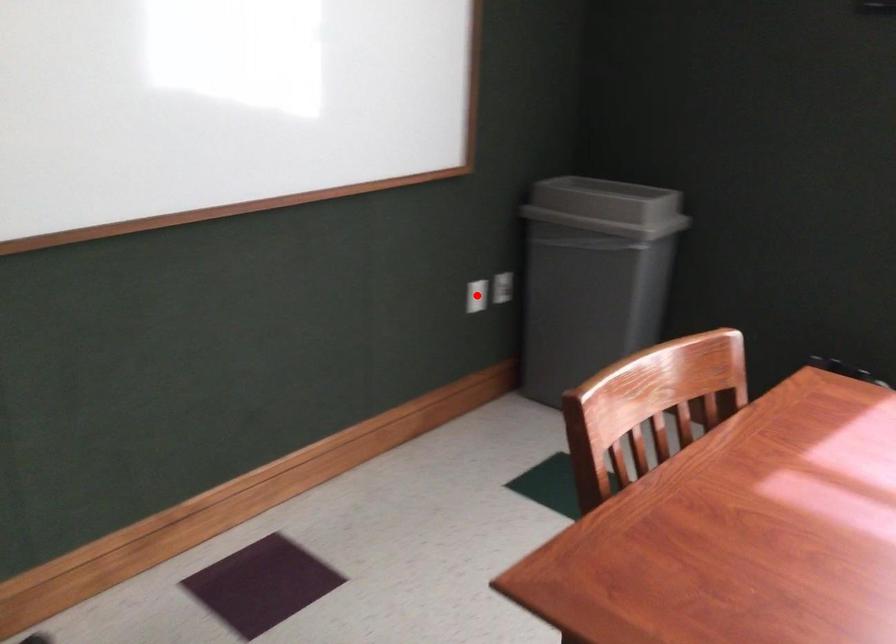
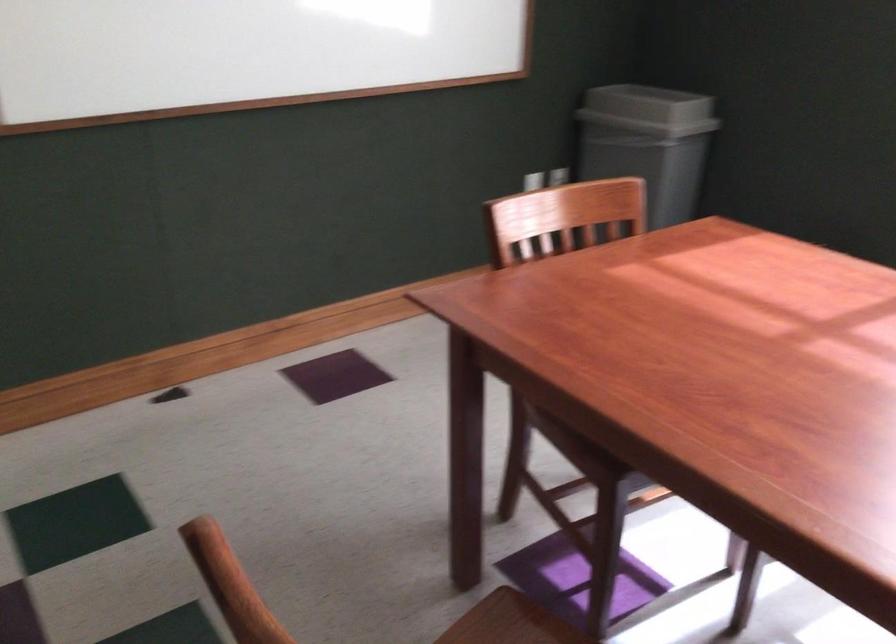
Question: I am providing you with two images of the same scene from different viewpoints. A red point is marked on the first image. Is the red point's position out of view in image 2?

Choices:
 (A) Yes
 (B) No

Answer: (A)